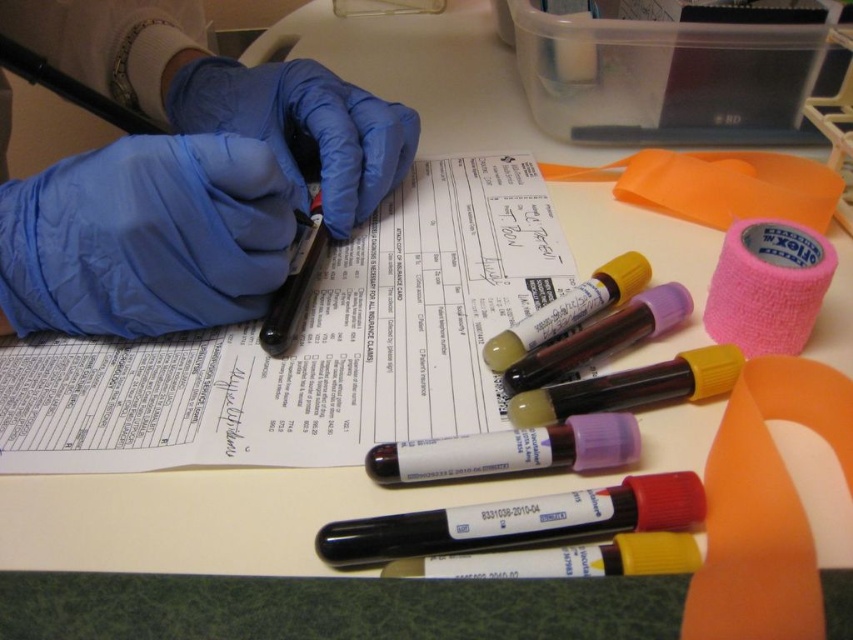
You are a healthcare worker who needs to sign a document. You see the white paper at center and the blue rubber glove at center. Which object is taller and should you be cautious about when handling the documents?

The white paper at center is much taller than the blue rubber glove at center. You should be cautious about the blue rubber glove at center as it may have contaminants and should be removed before handling documents to prevent contamination.

Looking at this image, you need to secure the pink fabric tape at upper right to the blue latex glove at upper left. Can you reach the tape without moving the glove?

The pink fabric tape at upper right is behind the blue latex glove at upper left, so you cannot reach it without moving the glove first.

You are standing in a lab and need to reach the point marked at coordinates (111,410). If your arm is 15 inches long, can you reach it without moving?

The point at coordinates (111,410) is 15.46 inches away from you, so your arm is slightly too short to reach it without moving.